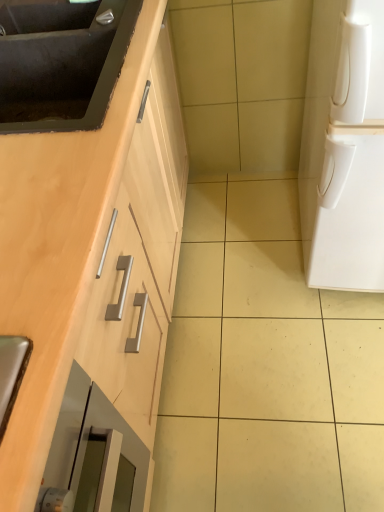
Question: Is matte black sink at upper left, positioned as the 2th sink in bottom-to-top order, aimed at white matte refrigerator at right?

Choices:
 (A) no
 (B) yes

Answer: (B)

Question: From the image's perspective, is matte black sink at upper left, positioned as the 2th sink in bottom-to-top order, on top of white matte refrigerator at right?

Choices:
 (A) no
 (B) yes

Answer: (B)

Question: Considering the relative sizes of matte black sink at upper left, which is the 1th sink in top-to-bottom order, and white matte refrigerator at right in the image provided, is matte black sink at upper left, which is the 1th sink in top-to-bottom order, shorter than white matte refrigerator at right?

Choices:
 (A) no
 (B) yes

Answer: (B)

Question: Is matte black sink at upper left, positioned as the 2th sink in bottom-to-top order, positioned before white matte refrigerator at right?

Choices:
 (A) yes
 (B) no

Answer: (B)

Question: Is matte black sink at upper left, which is the 1th sink in top-to-bottom order, surrounding white matte refrigerator at right?

Choices:
 (A) no
 (B) yes

Answer: (A)

Question: Would you consider matte black sink at upper left, positioned as the 2th sink in bottom-to-top order, to be distant from white matte refrigerator at right?

Choices:
 (A) no
 (B) yes

Answer: (A)

Question: From the image's perspective, is matte black sink at upper left, the 2th sink when ordered from top to bottom, located beneath matte black sink at upper left, positioned as the 2th sink in bottom-to-top order?

Choices:
 (A) yes
 (B) no

Answer: (A)

Question: Considering the relative sizes of matte black sink at upper left, the 2th sink when ordered from top to bottom, and matte black sink at upper left, which is the 1th sink in top-to-bottom order, in the image provided, is matte black sink at upper left, the 2th sink when ordered from top to bottom, taller than matte black sink at upper left, which is the 1th sink in top-to-bottom order,?

Choices:
 (A) no
 (B) yes

Answer: (B)

Question: Is matte black sink at upper left, the 2th sink when ordered from top to bottom, oriented away from matte black sink at upper left, which is the 1th sink in top-to-bottom order?

Choices:
 (A) yes
 (B) no

Answer: (B)

Question: Is matte black sink at upper left, which is counted as the first sink, starting from the bottom, further to the viewer compared to matte black sink at upper left, positioned as the 2th sink in bottom-to-top order?

Choices:
 (A) no
 (B) yes

Answer: (A)

Question: From a real-world perspective, is matte black sink at upper left, the 2th sink when ordered from top to bottom, on matte black sink at upper left, positioned as the 2th sink in bottom-to-top order?

Choices:
 (A) yes
 (B) no

Answer: (B)

Question: Can you confirm if matte black sink at upper left, the 2th sink when ordered from top to bottom, is thinner than matte black sink at upper left, which is the 1th sink in top-to-bottom order?

Choices:
 (A) yes
 (B) no

Answer: (B)

Question: Is matte black sink at upper left, which is counted as the first sink, starting from the bottom, in front of white matte refrigerator at right?

Choices:
 (A) no
 (B) yes

Answer: (A)